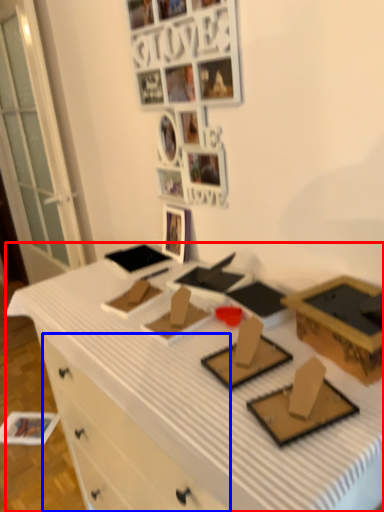
Question: Which object appears farthest to the camera in this image, desk (highlighted by a red box) or drawer (highlighted by a blue box)?

Choices:
 (A) desk
 (B) drawer

Answer: (B)